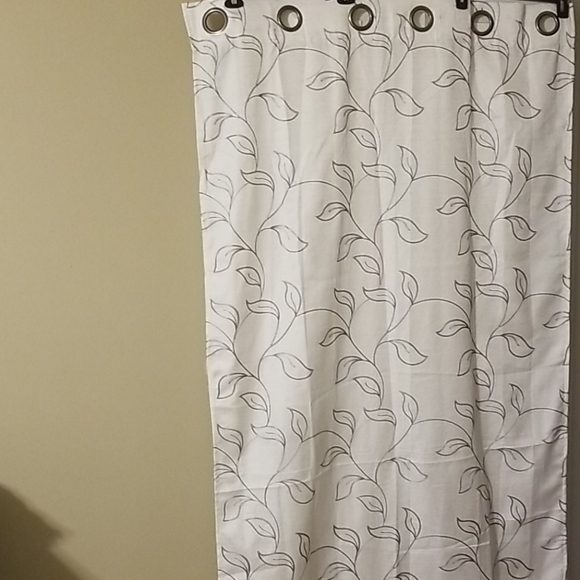
Locate an element on the screen. plants on shower curtain is located at coordinates (400, 223).